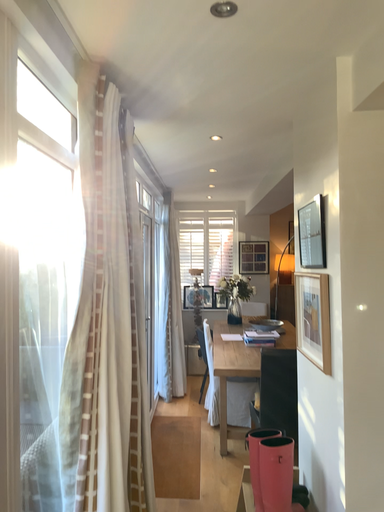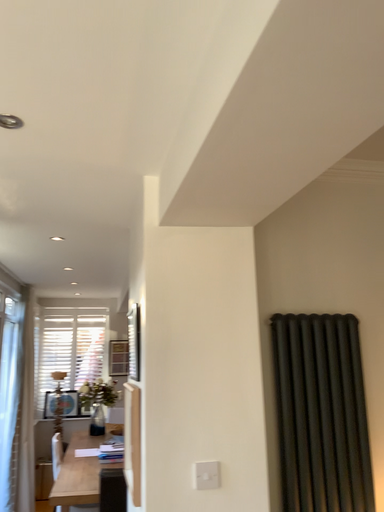
Question: How did the camera likely rotate when shooting the video?

Choices:
 (A) rotated left
 (B) rotated right

Answer: (B)